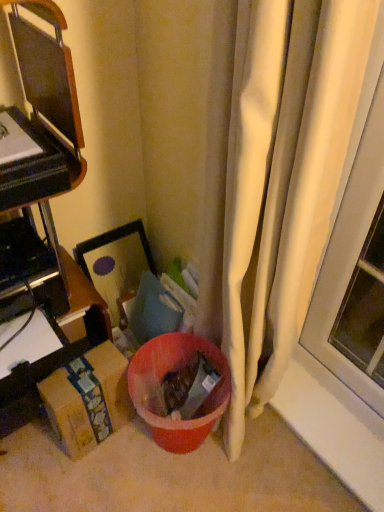
Question: Can you confirm if white fabric curtain at right is shorter than brown cardboard box at left, which is the first furniture in bottom-to-top order?

Choices:
 (A) no
 (B) yes

Answer: (A)

Question: Considering the relative sizes of white fabric curtain at right and brown cardboard box at left, which is the first furniture in bottom-to-top order, in the image provided, is white fabric curtain at right bigger than brown cardboard box at left, which is the first furniture in bottom-to-top order,?

Choices:
 (A) yes
 (B) no

Answer: (A)

Question: Is white fabric curtain at right facing towards brown cardboard box at left, which is the first furniture in bottom-to-top order?

Choices:
 (A) yes
 (B) no

Answer: (B)

Question: Does white fabric curtain at right have a greater width compared to brown cardboard box at left, which ranks as the 2th furniture in top-to-bottom order?

Choices:
 (A) yes
 (B) no

Answer: (B)

Question: Considering the relative positions of white fabric curtain at right and brown cardboard box at left, which ranks as the 2th furniture in top-to-bottom order, in the image provided, is white fabric curtain at right to the right of brown cardboard box at left, which ranks as the 2th furniture in top-to-bottom order, from the viewer's perspective?

Choices:
 (A) yes
 (B) no

Answer: (A)

Question: From their relative heights in the image, would you say brown cardboard box at left, the 1th furniture viewed from the top, is taller or shorter than brown cardboard box at left, which is the first furniture in bottom-to-top order?

Choices:
 (A) short
 (B) tall

Answer: (B)

Question: From a real-world perspective, is brown cardboard box at left, the 1th furniture viewed from the top, physically located above or below brown cardboard box at left, which is the first furniture in bottom-to-top order?

Choices:
 (A) above
 (B) below

Answer: (A)

Question: Based on their sizes in the image, would you say brown cardboard box at left, the second furniture ordered from the bottom, is bigger or smaller than brown cardboard box at left, which is the first furniture in bottom-to-top order?

Choices:
 (A) small
 (B) big

Answer: (B)

Question: Is brown cardboard box at left, the second furniture ordered from the bottom, inside or outside of brown cardboard box at left, which ranks as the 2th furniture in top-to-bottom order?

Choices:
 (A) outside
 (B) inside

Answer: (A)

Question: In terms of width, does brown cardboard box at lower left look wider or thinner when compared to brown cardboard box at left, which is the first furniture in bottom-to-top order?

Choices:
 (A) thin
 (B) wide

Answer: (A)

Question: Is brown cardboard box at lower left in front of or behind brown cardboard box at left, which is the first furniture in bottom-to-top order, in the image?

Choices:
 (A) behind
 (B) front

Answer: (B)

Question: Considering the positions of point (89, 381) and point (29, 387), is point (89, 381) closer or farther from the camera than point (29, 387)?

Choices:
 (A) farther
 (B) closer

Answer: (B)

Question: From the image's perspective, relative to brown cardboard box at left, which is the first furniture in bottom-to-top order, is brown cardboard box at lower left above or below?

Choices:
 (A) below
 (B) above

Answer: (A)

Question: Which is correct: white fabric curtain at right is inside brown cardboard box at left, which is the first furniture in bottom-to-top order, or outside of it?

Choices:
 (A) outside
 (B) inside

Answer: (A)

Question: Does point 215,256 appear closer or farther from the camera than point 6,403?

Choices:
 (A) farther
 (B) closer

Answer: (B)